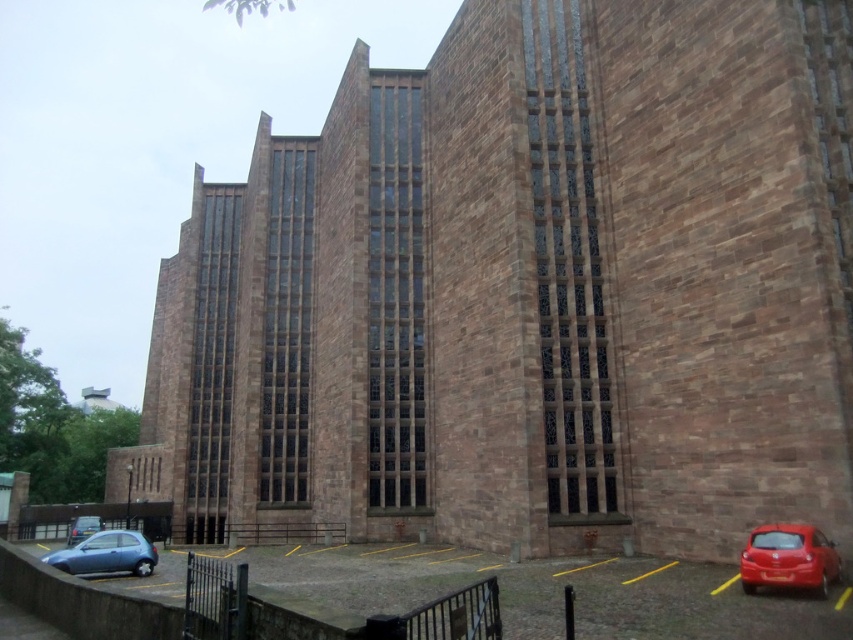
You are a delivery person trying to park your van between the shiny red car at lower right and the metallic silver car at lower left. Your van is 2.5 meters wide. Can you fit your van in the space between them?

The shiny red car at lower right has a lesser width compared to metallic silver car at lower left. Since the red car is narrower, the space between the two cars may be sufficient for your van. However, without knowing the exact distance between them, it is uncertain if the 2.5 meter van will fit. The width comparison alone does not determine the available space between them.

You are a delivery driver who needs to park your truck in the parking lot. The truck is 10 feet wide. Can you park your truck in the smooth asphalt parking lot at lower center without overlapping the metallic silver car at lower left?

The smooth asphalt parking lot at lower center is positioned over the metallic silver car at lower left, which means the parking lot is already occupied by the car. Therefore, you cannot park your truck there without overlapping the car.

In the scene shown: You are standing at the entrance of the building and want to walk to the point marked by point (67, 561) and point (97, 531). Which point is closer to the building?

Point (97, 531) is closer to the building because it is behind point (67, 561).